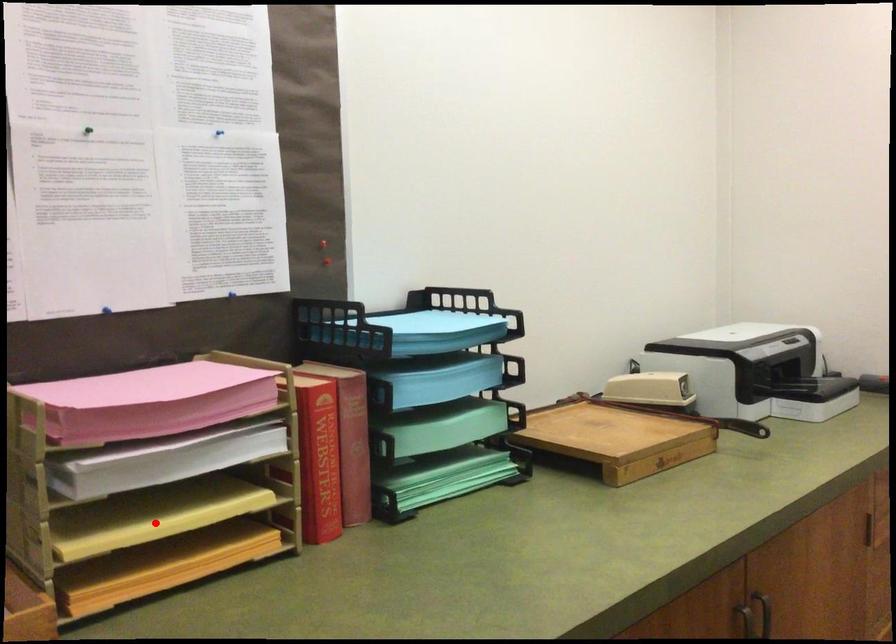
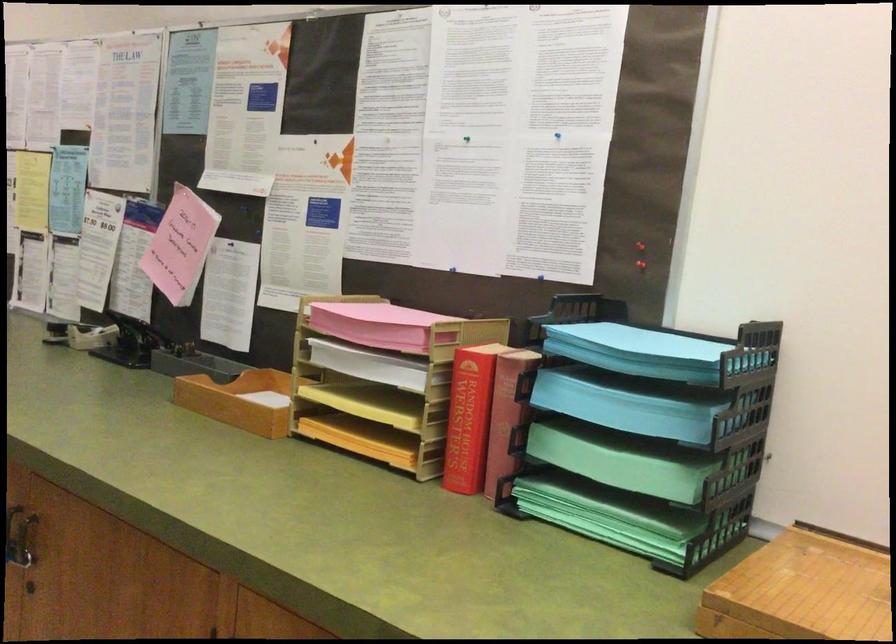
In the second image, find the point that corresponds to the highlighted location in the first image.

(367, 404)